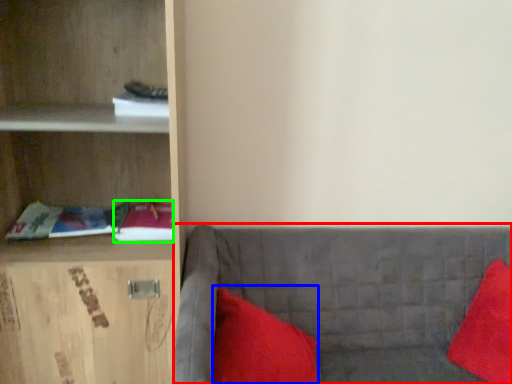
Question: Based on their relative distances, which object is farther from studio couch (highlighted by a red box)? Choose from pillow (highlighted by a blue box) and book (highlighted by a green box).

Choices:
 (A) pillow
 (B) book

Answer: (B)